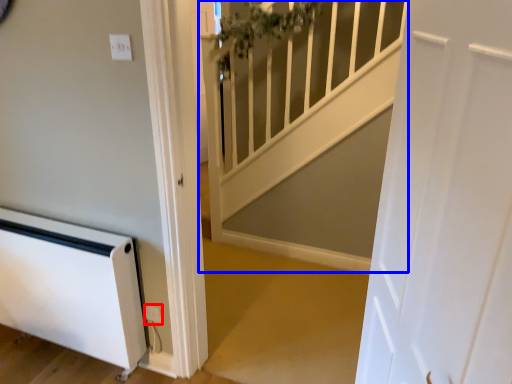
Question: Which point is further to the camera, electric outlet (highlighted by a red box) or stairwell (highlighted by a blue box)?

Choices:
 (A) electric outlet
 (B) stairwell

Answer: (A)